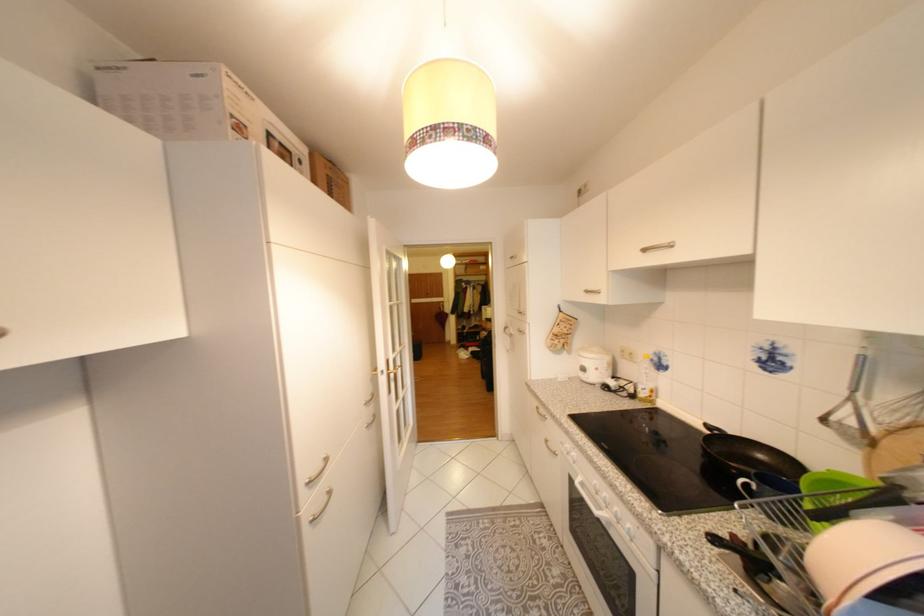
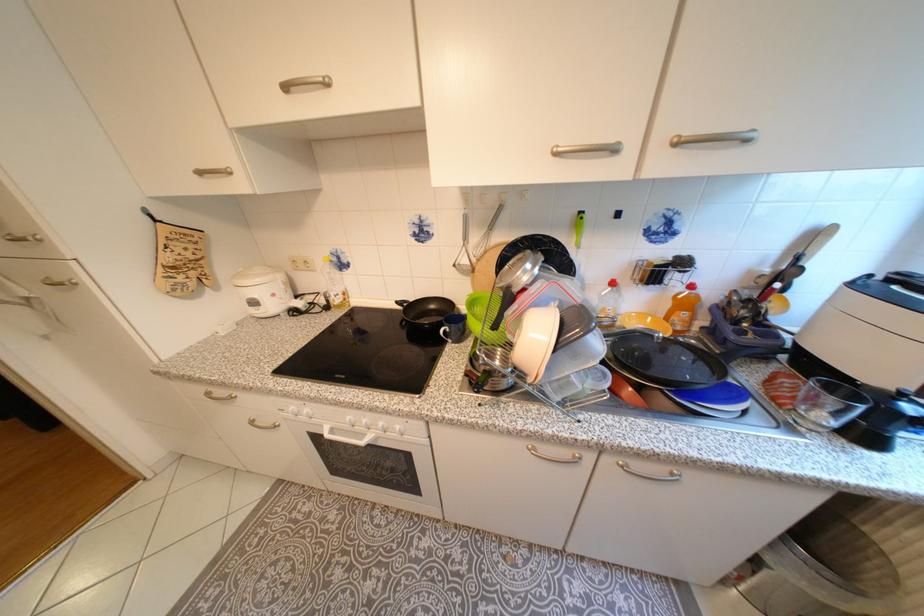
Find the pixel in the second image that matches (592,370) in the first image.

(263, 304)